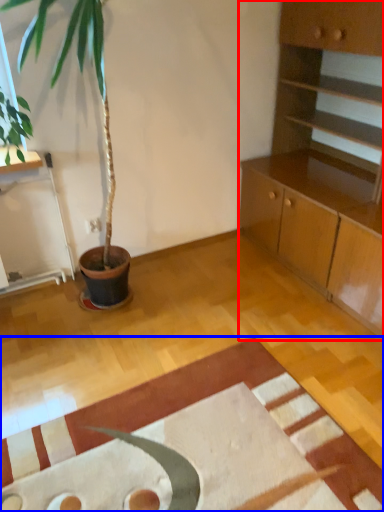
Question: Among these objects, which one is nearest to the camera, cabinetry (highlighted by a red box) or mat (highlighted by a blue box)?

Choices:
 (A) cabinetry
 (B) mat

Answer: (B)